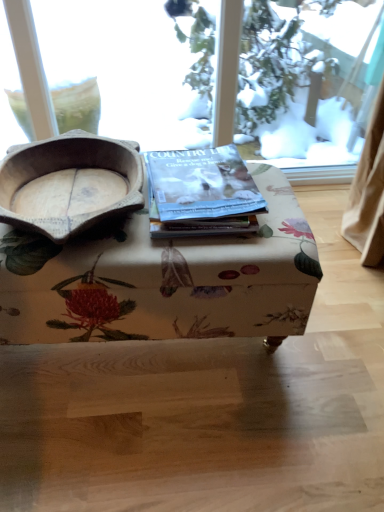
Question: Is the surface of matte paper magazine at center in direct contact with wooden bowl at left?

Choices:
 (A) yes
 (B) no

Answer: (B)

Question: From a real-world perspective, is matte paper magazine at center below wooden bowl at left?

Choices:
 (A) no
 (B) yes

Answer: (B)

Question: From a real-world perspective, is matte paper magazine at center physically above wooden bowl at left?

Choices:
 (A) no
 (B) yes

Answer: (A)

Question: Considering the relative positions of matte paper magazine at center and wooden bowl at left in the image provided, is matte paper magazine at center behind wooden bowl at left?

Choices:
 (A) no
 (B) yes

Answer: (B)

Question: Is matte paper magazine at center wider than wooden bowl at left?

Choices:
 (A) yes
 (B) no

Answer: (B)

Question: Can you confirm if matte paper magazine at center is taller than wooden bowl at left?

Choices:
 (A) no
 (B) yes

Answer: (A)

Question: From the image's perspective, does wooden bowl at left appear lower than matte paper magazine at center?

Choices:
 (A) no
 (B) yes

Answer: (B)

Question: From a real-world perspective, is wooden bowl at left physically above matte paper magazine at center?

Choices:
 (A) yes
 (B) no

Answer: (A)

Question: Does wooden bowl at left appear on the left side of matte paper magazine at center?

Choices:
 (A) yes
 (B) no

Answer: (A)

Question: Can you confirm if wooden bowl at left is wider than matte paper magazine at center?

Choices:
 (A) no
 (B) yes

Answer: (B)

Question: Does wooden bowl at left have a lesser width compared to matte paper magazine at center?

Choices:
 (A) no
 (B) yes

Answer: (A)

Question: Is wooden bowl at left in contact with matte paper magazine at center?

Choices:
 (A) yes
 (B) no

Answer: (B)

Question: From the image's perspective, is floral fabric ottoman at center beneath wooden bowl at left?

Choices:
 (A) yes
 (B) no

Answer: (A)